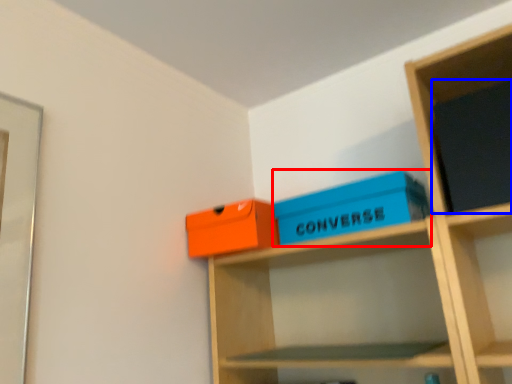
Question: Which point is further to the camera, box (highlighted by a red box) or paperback book (highlighted by a blue box)?

Choices:
 (A) box
 (B) paperback book

Answer: (A)